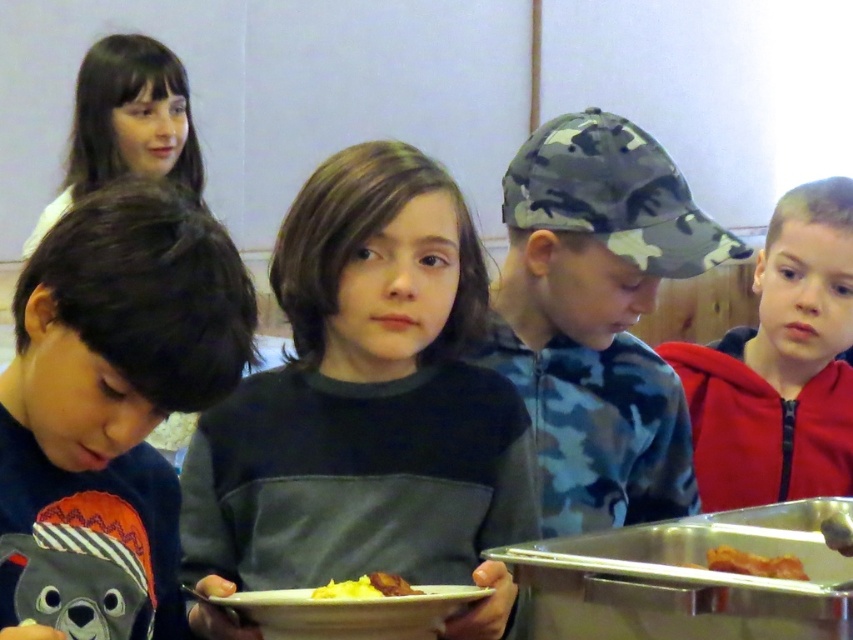
I want to click on dark gray cotton shirt at center, so click(x=368, y=404).

Between dark gray cotton shirt at center and golden crispy bacon at lower right, which one has more height?

dark gray cotton shirt at center

Is point (358, 168) in front of point (714, 556)?

That is False.

Locate an element on the screen. dark gray cotton shirt at center is located at coordinates (368, 404).

Is point (334, 540) positioned after point (614, 436)?

No, (334, 540) is closer to viewer.

Does dark gray cotton shirt at center have a lesser height compared to camo fabric cap at center?

Indeed, dark gray cotton shirt at center has a lesser height compared to camo fabric cap at center.

Is point (375, 179) behind point (577, 280)?

No, it is not.

Where is `dark gray cotton shirt at center`? This screenshot has width=853, height=640. dark gray cotton shirt at center is located at coordinates (368, 404).

Find the location of a particular element. This screenshot has width=853, height=640. camo fabric cap at center is located at coordinates (596, 317).

Find the location of a particular element. The width and height of the screenshot is (853, 640). camo fabric cap at center is located at coordinates (596, 317).